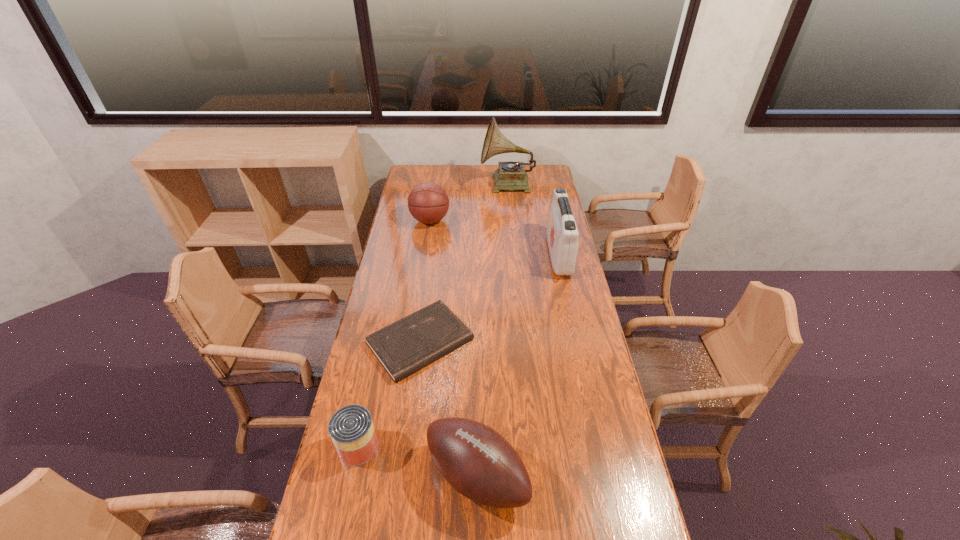
I want to click on basketball located at the left edge, so click(x=428, y=202).

Identify the location of can present at the left edge. (351, 428).

At what (x,y) coordinates should I click in order to perform the action: click on paperback book positioned at the left edge. Please return your answer as a coordinate pair (x, y). This screenshot has width=960, height=540. Looking at the image, I should click on (413, 342).

Identify the location of record player positioned at the right edge. (511, 175).

This screenshot has width=960, height=540. I want to click on the first-aid kit that is at the right edge, so click(562, 234).

The width and height of the screenshot is (960, 540). I want to click on object that is at the far right corner, so click(511, 175).

The width and height of the screenshot is (960, 540). In the image, there is a desktop. Find the location of `vacant space at the left edge`. vacant space at the left edge is located at coordinates (404, 195).

Locate an element on the screen. The image size is (960, 540). free space at the right edge is located at coordinates pyautogui.click(x=620, y=479).

Where is `blank area at the far left corner`? Image resolution: width=960 pixels, height=540 pixels. blank area at the far left corner is located at coordinates (405, 180).

In the image, there is a desktop. At what (x,y) coordinates should I click in order to perform the action: click on vacant space at the far right corner. Please return your answer as a coordinate pair (x, y). This screenshot has height=540, width=960. Looking at the image, I should click on (532, 166).